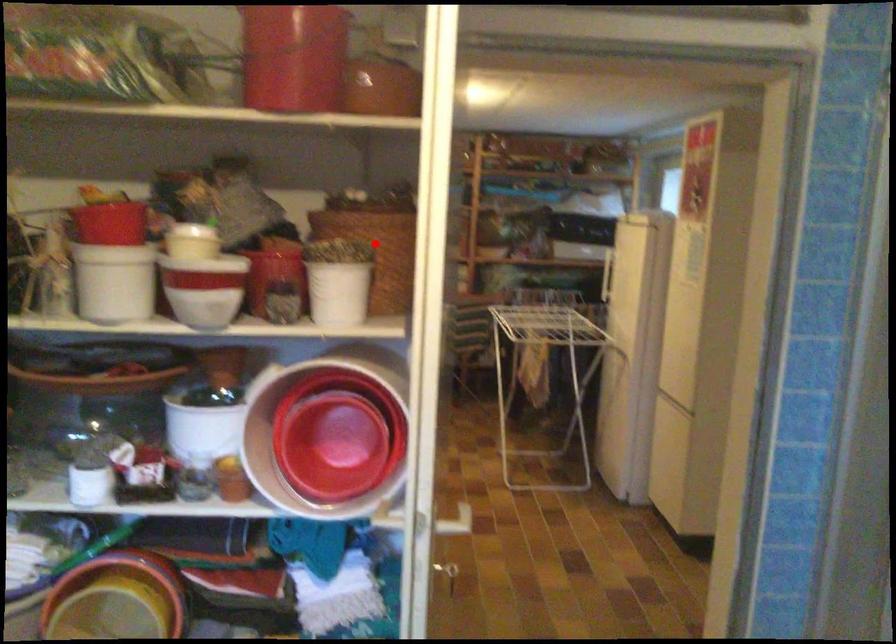
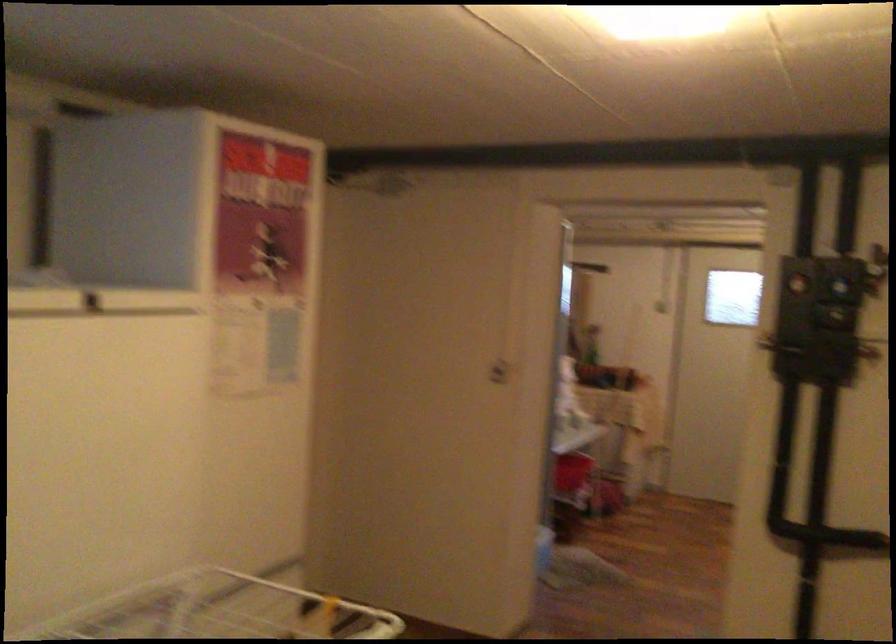
Question: I am providing you with two images of the same scene from different viewpoints. A red point is marked on the first image. At the location where the point appears in image 1, is it still visible in image 2?

Choices:
 (A) Yes
 (B) No

Answer: (B)